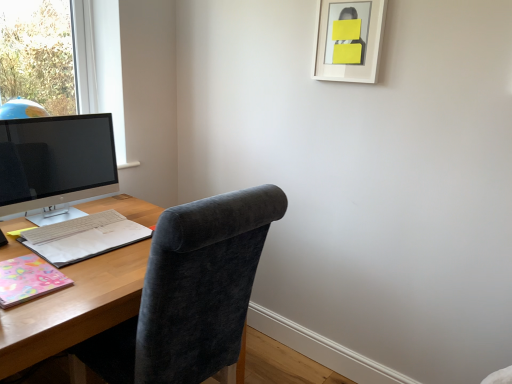
You are a GUI agent. You are given a task and a screenshot of the screen. Output one action in this format:
    pyautogui.click(x=<x>, y=<y>)
    Task: Click on the free space that is in between multicolored paper notebook at left, acting as the second notebook starting from the front, and pastel floral paper at lower left, which is the 2th notebook from back to front
    Image resolution: width=512 pixels, height=384 pixels.
    Given the screenshot: What is the action you would take?
    74,264